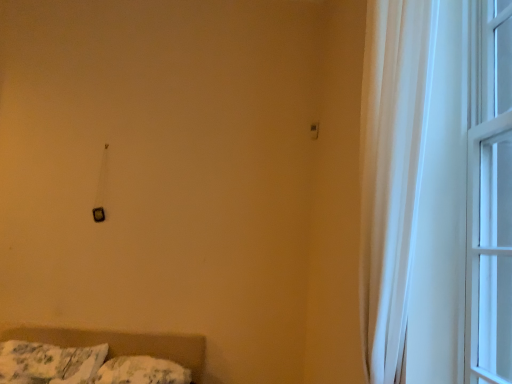
Question: In terms of width, does white sheer curtain at right, acting as the second window starting from the right, look wider or thinner when compared to matte black switch at upper center?

Choices:
 (A) thin
 (B) wide

Answer: (B)

Question: Considering the positions of point (443, 211) and point (315, 132), is point (443, 211) closer or farther from the camera than point (315, 132)?

Choices:
 (A) closer
 (B) farther

Answer: (A)

Question: Which of these objects is positioned closest to the fluffy white pillow at lower left, placed as the first pillow when sorted from left to right?

Choices:
 (A) matte black switch at upper center
 (B) white glass window at right, which is the second window from left to right
 (C) fluffy white pillow at lower left, placed as the first pillow when sorted from right to left
 (D) white sheer curtain at right, which ranks as the first window in left-to-right order

Answer: (C)

Question: Which of these objects is positioned closest to the white glass window at right, the first window in the right-to-left sequence?

Choices:
 (A) matte black switch at upper center
 (B) fluffy white pillow at lower left, placed as the first pillow when sorted from left to right
 (C) fluffy white pillow at lower left, placed as the first pillow when sorted from right to left
 (D) white sheer curtain at right, acting as the second window starting from the right

Answer: (D)